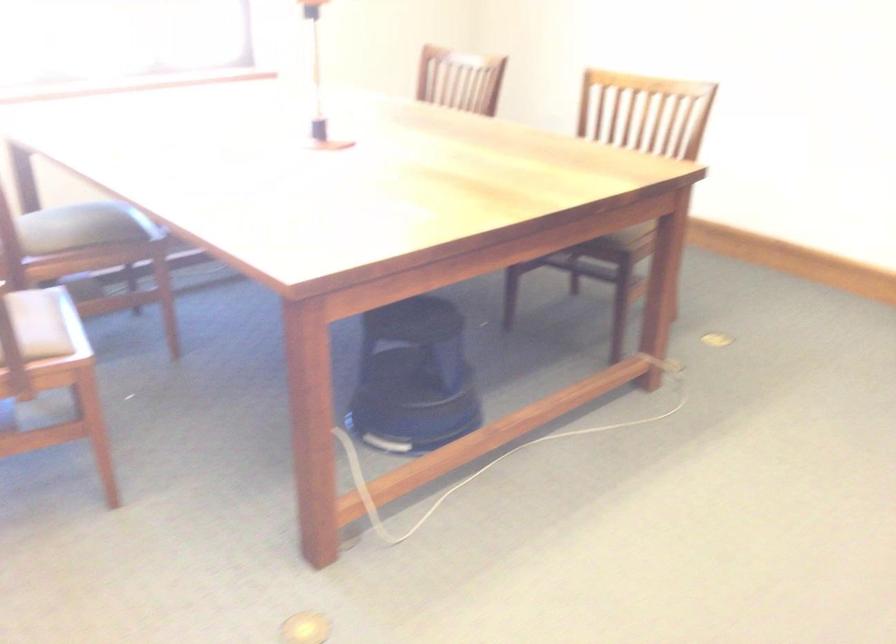
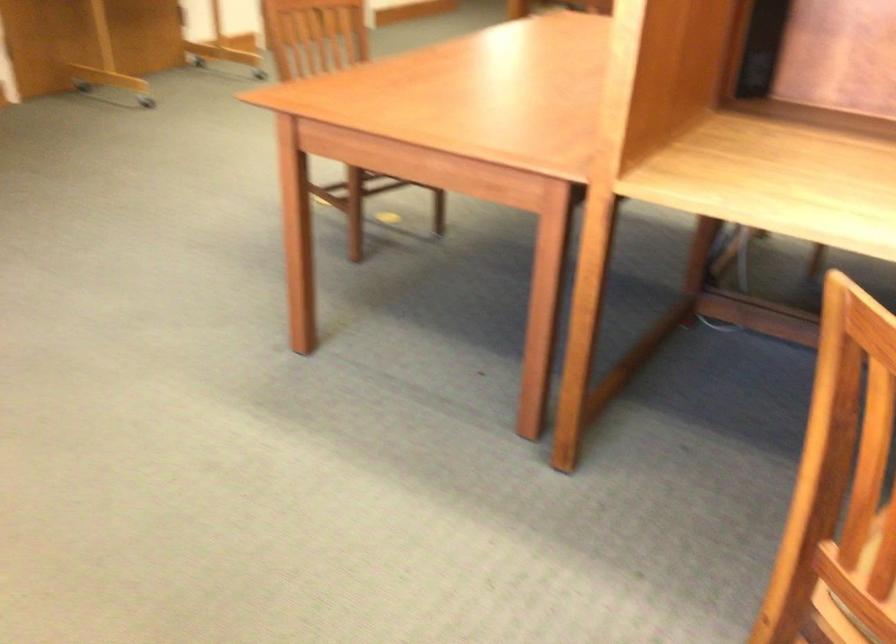
First-person continuous shooting, in which direction is the camera rotating?

The camera's rotation is toward right-down.